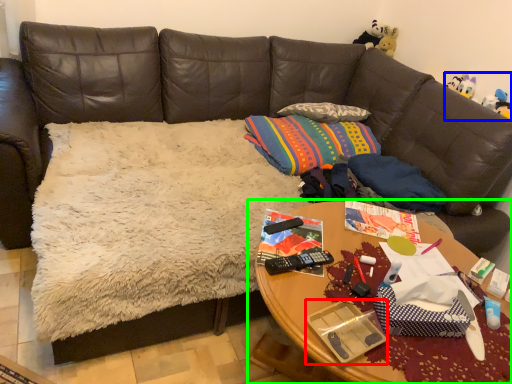
Question: Estimate the real-world distances between objects in this image. Which object is farther from package (highlighted by a red box), toy (highlighted by a blue box) or table (highlighted by a green box)?

Choices:
 (A) toy
 (B) table

Answer: (A)